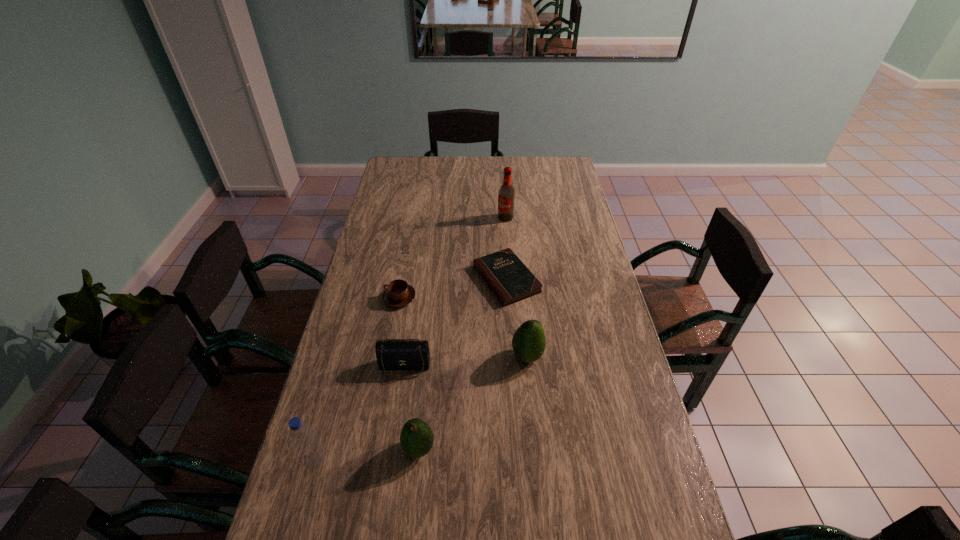
Considering the uniform spacing of avocados, where should an additional avocado be positioned on the right? Please locate a free spot. Please provide its 2D coordinates. Your answer should be formatted as a tuple, i.e. [(x, y)], where the tuple contains the x and y coordinates of a point satisfying the conditions above.

[(606, 289)]